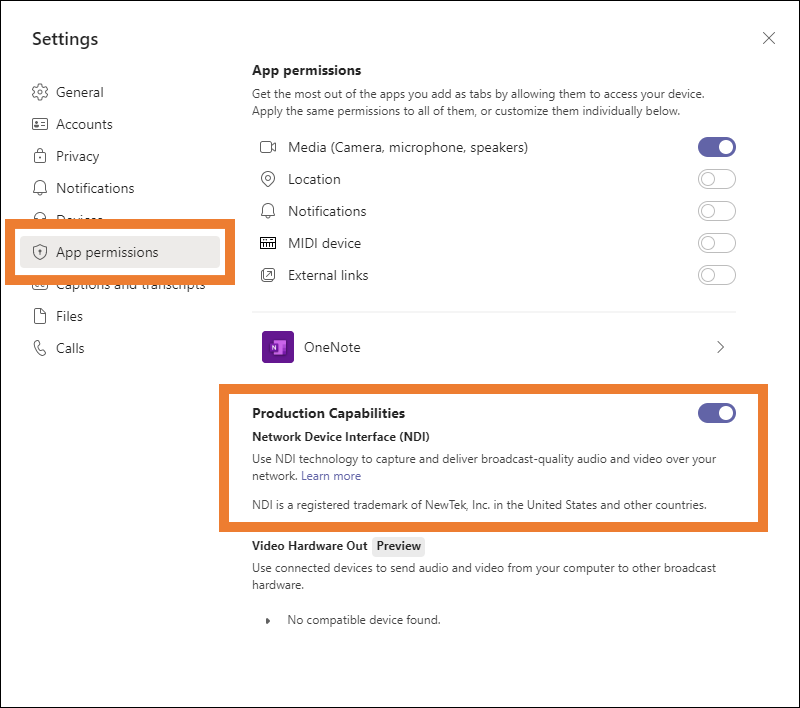
Identify the location of lock. The width and height of the screenshot is (800, 708). click(x=40, y=159).